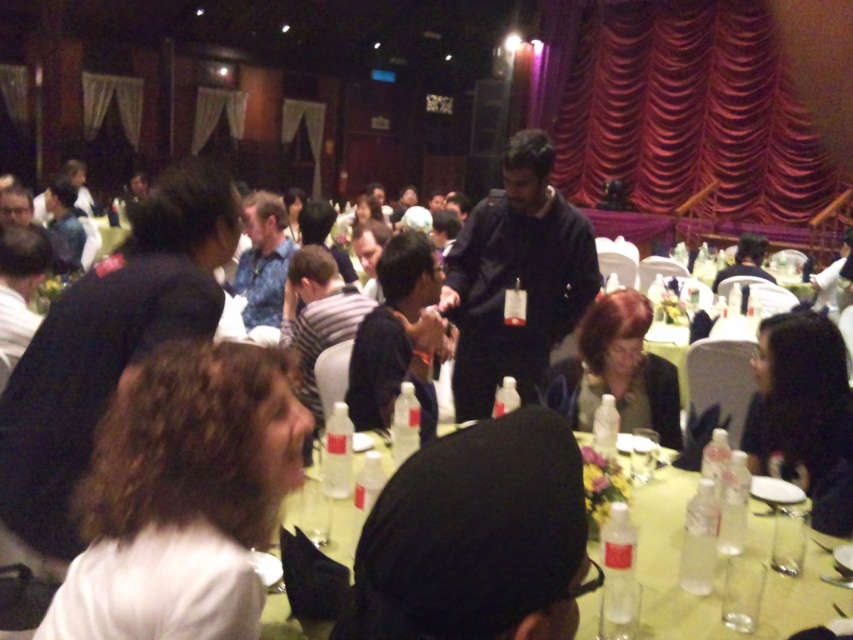
Question: Is curly hair at lower left smaller than dark brown hair at center?

Choices:
 (A) no
 (B) yes

Answer: (B)

Question: Is the position of red velvet curtain at upper right more distant than that of dark brown hair at center?

Choices:
 (A) yes
 (B) no

Answer: (A)

Question: Among these points, which one is nearest to the camera?

Choices:
 (A) (294, 520)
 (B) (756, 269)
 (C) (520, 148)

Answer: (A)

Question: Is clear plastic bottles at center smaller than matte black jacket at center?

Choices:
 (A) no
 (B) yes

Answer: (B)

Question: Among these objects, which one is nearest to the camera?

Choices:
 (A) clear plastic bottles at center
 (B) red velvet curtain at upper right

Answer: (A)

Question: Which point is farther to the camera?

Choices:
 (A) black matte jacket at center
 (B) black matte shirt at center
 (C) red velvet curtain at upper right

Answer: (C)